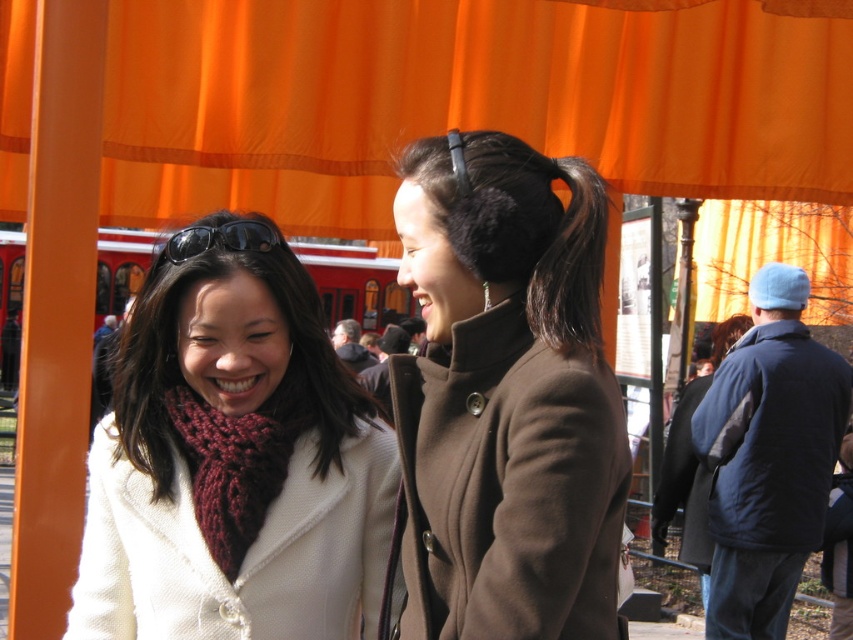
Who is positioned more to the right, white woolen coat at center or black wool coat at right?

From the viewer's perspective, black wool coat at right appears more on the right side.

Between white woolen coat at center and black wool coat at right, which one has more height?

white woolen coat at center

Locate an element on the screen. This screenshot has height=640, width=853. white woolen coat at center is located at coordinates (231, 458).

What do you see at coordinates (520, 225) in the screenshot? This screenshot has width=853, height=640. I see `fuzzy black earmuffs at center` at bounding box center [520, 225].

Does fuzzy black earmuffs at center have a larger size compared to dark brown silky hair at upper center?

Indeed, fuzzy black earmuffs at center has a larger size compared to dark brown silky hair at upper center.

Is point (532, 198) farther from camera compared to point (575, 285)?

No, it is in front of (575, 285).

Identify the location of fuzzy black earmuffs at center. This screenshot has width=853, height=640. (520, 225).

Describe the element at coordinates (460, 100) in the screenshot. This screenshot has width=853, height=640. I see `orange fabric canopy at upper center` at that location.

In the scene shown: Can you confirm if orange fabric canopy at upper center is taller than fuzzy black earmuffs at center?

Incorrect, orange fabric canopy at upper center's height is not larger of fuzzy black earmuffs at center's.

Is point (795, 129) in front of point (496, 266)?

No, it is behind (496, 266).

Locate an element on the screen. The height and width of the screenshot is (640, 853). orange fabric canopy at upper center is located at coordinates (460, 100).